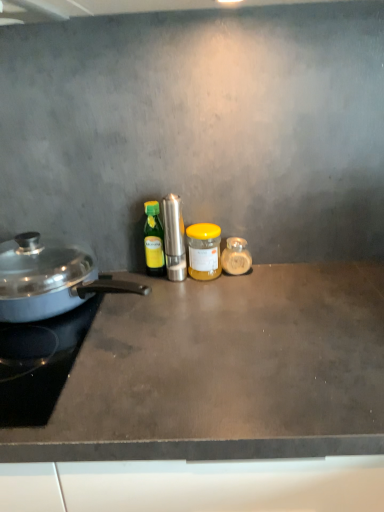
Identify the location of vacant area that is situated to the right of translucent glass jar at center, the first kitchen appliance when ordered from right to left. (302, 279).